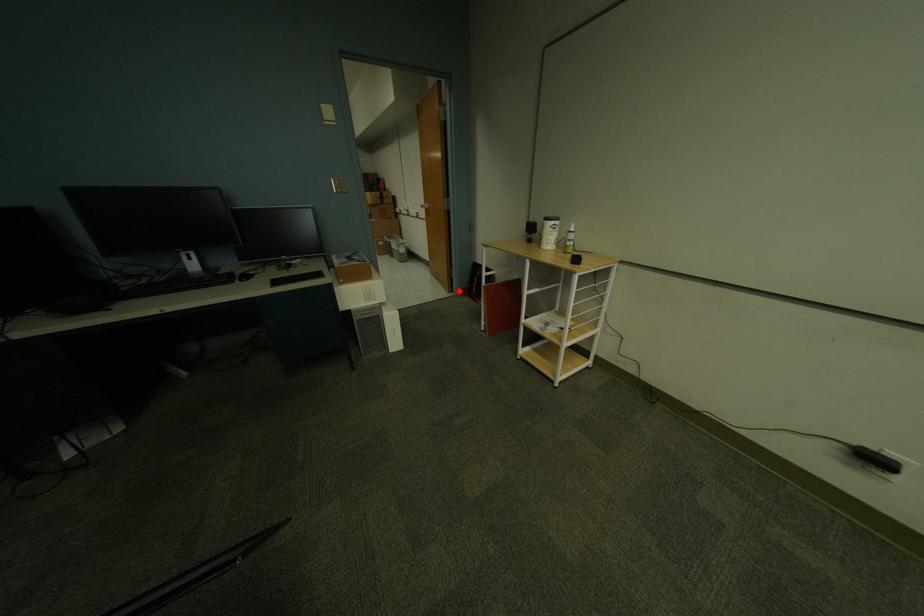
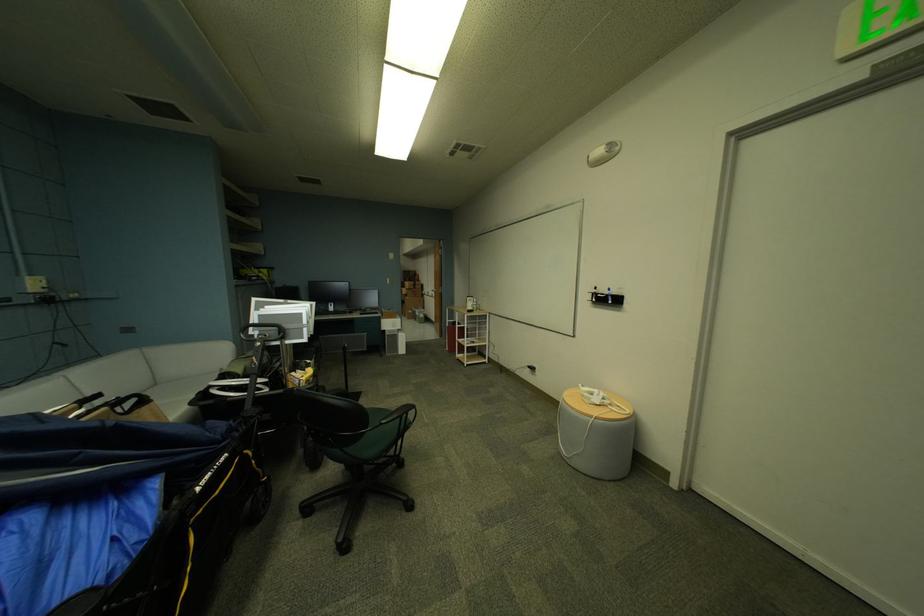
Question: I am providing you with two images of the same scene from different viewpoints. In image1, a red point is highlighted. Considering the same 3D point in image2, which of the following is correct?

Choices:
 (A) It is closer
 (B) It is farther

Answer: (B)